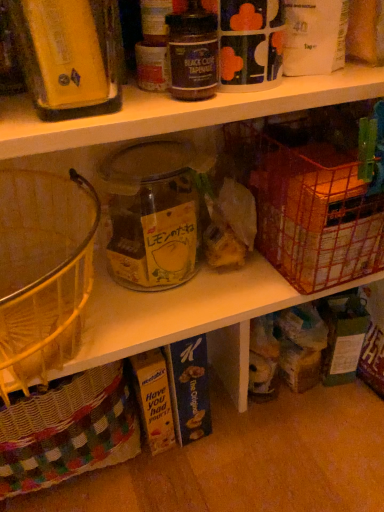
Question: Is black glass jar at upper center, the 1th bottle when ordered from right to left, to the left of metallic wire basket at right from the viewer's perspective?

Choices:
 (A) no
 (B) yes

Answer: (B)

Question: Considering the relative sizes of black glass jar at upper center, which ranks as the 2th bottle in left-to-right order, and metallic wire basket at right in the image provided, is black glass jar at upper center, which ranks as the 2th bottle in left-to-right order, taller than metallic wire basket at right?

Choices:
 (A) no
 (B) yes

Answer: (A)

Question: Can you confirm if black glass jar at upper center, the 1th bottle when ordered from right to left, is bigger than metallic wire basket at right?

Choices:
 (A) yes
 (B) no

Answer: (B)

Question: Does black glass jar at upper center, which ranks as the 2th bottle in left-to-right order, have a smaller size compared to metallic wire basket at right?

Choices:
 (A) yes
 (B) no

Answer: (A)

Question: From a real-world perspective, is black glass jar at upper center, the 1th bottle when ordered from right to left, below metallic wire basket at right?

Choices:
 (A) no
 (B) yes

Answer: (A)

Question: Is point (82, 67) positioned closer to the camera than point (163, 208)?

Choices:
 (A) closer
 (B) farther

Answer: (A)

Question: In the image, is matte yellow container at upper left, the 1th bottle from the left, positioned in front of or behind transparent glass jar at center?

Choices:
 (A) behind
 (B) front

Answer: (B)

Question: Considering the relative positions of matte yellow container at upper left, arranged as the 2th bottle when viewed from the right, and transparent glass jar at center in the image provided, is matte yellow container at upper left, arranged as the 2th bottle when viewed from the right, to the left or to the right of transparent glass jar at center?

Choices:
 (A) left
 (B) right

Answer: (A)

Question: Is matte yellow container at upper left, the 1th bottle from the left, bigger or smaller than transparent glass jar at center?

Choices:
 (A) big
 (B) small

Answer: (B)

Question: Is metallic wire basket at right inside the boundaries of transparent glass jar at center, or outside?

Choices:
 (A) outside
 (B) inside

Answer: (A)

Question: Considering the positions of metallic wire basket at right and transparent glass jar at center in the image, is metallic wire basket at right bigger or smaller than transparent glass jar at center?

Choices:
 (A) big
 (B) small

Answer: (A)

Question: Visually, is metallic wire basket at right positioned to the left or to the right of transparent glass jar at center?

Choices:
 (A) right
 (B) left

Answer: (A)

Question: Considering the positions of metallic wire basket at right and transparent glass jar at center in the image, is metallic wire basket at right wider or thinner than transparent glass jar at center?

Choices:
 (A) thin
 (B) wide

Answer: (B)

Question: Looking at the image, does metallic wire basket at right seem bigger or smaller compared to matte yellow container at upper left, the 1th bottle from the left?

Choices:
 (A) small
 (B) big

Answer: (B)

Question: Does point (274, 177) appear closer or farther from the camera than point (59, 45)?

Choices:
 (A) farther
 (B) closer

Answer: (A)